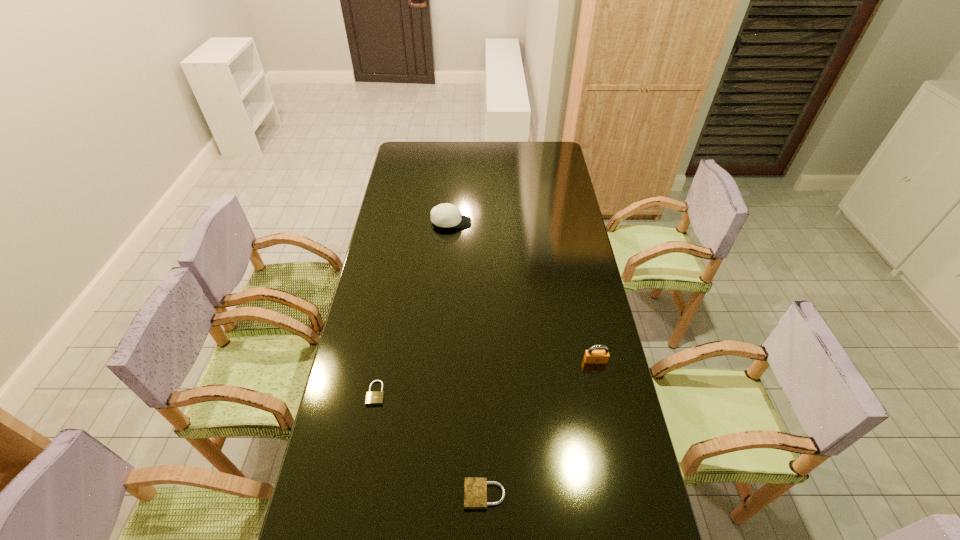
Where is `free point between the farthest object and the rightmost object`? free point between the farthest object and the rightmost object is located at coordinates (523, 292).

This screenshot has width=960, height=540. I want to click on free area in between the farthest padlock and the farthest object, so click(523, 292).

This screenshot has width=960, height=540. I want to click on free space between the farthest object and the nearest object, so click(468, 359).

At what (x,y) coordinates should I click in order to perform the action: click on empty space that is in between the leftmost object and the second shortest object. Please return your answer as a coordinate pair (x, y). Image resolution: width=960 pixels, height=540 pixels. Looking at the image, I should click on click(430, 444).

Locate an element on the screen. free space between the shortest object and the nearest padlock is located at coordinates (430, 444).

Image resolution: width=960 pixels, height=540 pixels. I want to click on vacant region between the leftmost padlock and the tallest padlock, so click(x=486, y=377).

Locate an element on the screen. This screenshot has height=540, width=960. free space between the rightmost object and the farthest object is located at coordinates (523, 292).

Locate an element on the screen. The height and width of the screenshot is (540, 960). free spot between the baseball cap and the second nearest object is located at coordinates point(414,308).

The width and height of the screenshot is (960, 540). I want to click on free point between the nearest padlock and the tallest padlock, so click(540, 428).

At what (x,y) coordinates should I click in order to perform the action: click on free point between the third nearest object and the second farthest padlock. Please return your answer as a coordinate pair (x, y). This screenshot has width=960, height=540. Looking at the image, I should click on (486, 377).